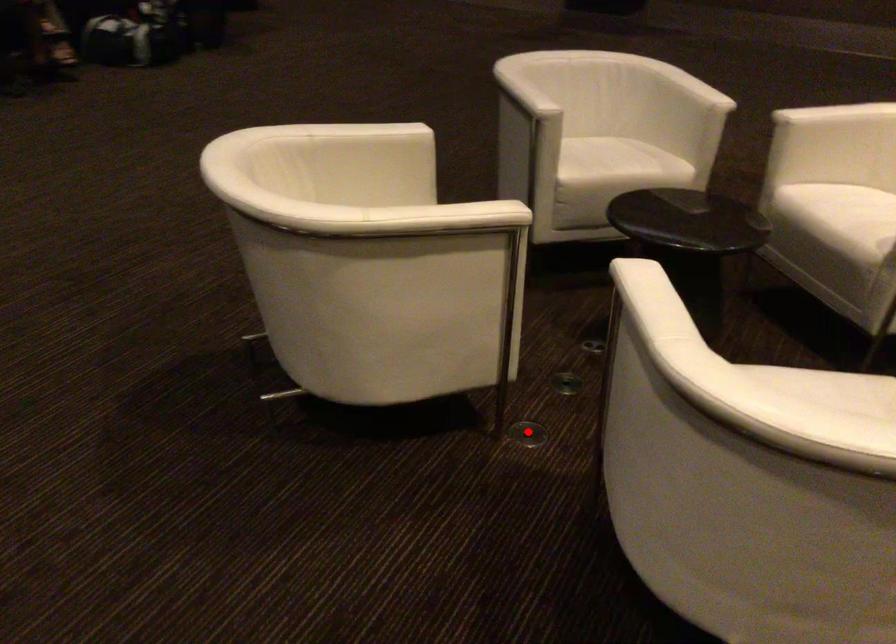
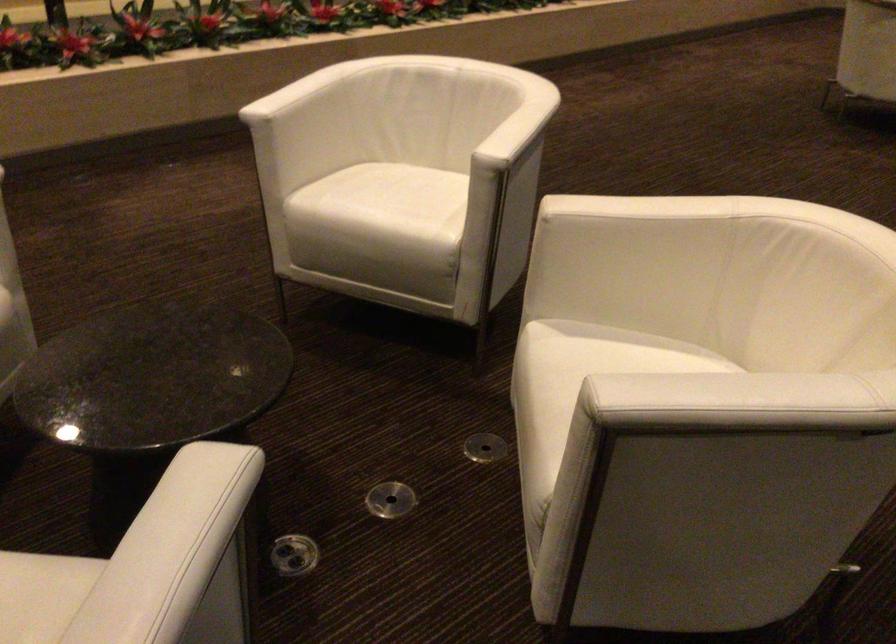
Locate, in the second image, the point that corresponds to the highlighted location in the first image.

(484, 447)